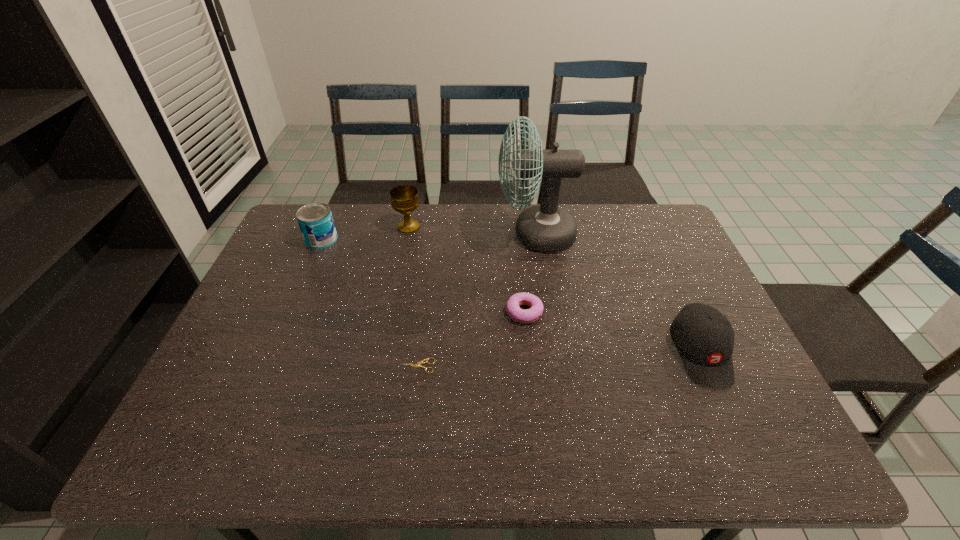
This screenshot has width=960, height=540. In the image, there is a desktop. Identify the location of blank space at the far edge. (423, 206).

I want to click on free space at the near edge, so click(x=649, y=455).

Image resolution: width=960 pixels, height=540 pixels. In order to click on vacant space at the right edge of the desktop in this screenshot , I will do `click(667, 296)`.

Find the location of a particular element. The width and height of the screenshot is (960, 540). blank space at the far left corner of the desktop is located at coordinates (335, 211).

This screenshot has width=960, height=540. I want to click on free location at the near left corner, so click(x=177, y=433).

Locate an element on the screen. The width and height of the screenshot is (960, 540). vacant region at the far right corner is located at coordinates (659, 224).

In order to click on vacant region between the shortest object and the baseball cap in this screenshot , I will do `click(559, 360)`.

Image resolution: width=960 pixels, height=540 pixels. I want to click on vacant area that lies between the leftmost object and the second tallest object, so click(365, 233).

Find the location of `free space between the second shortest object and the fan`. free space between the second shortest object and the fan is located at coordinates (530, 274).

This screenshot has width=960, height=540. Find the location of `blank region between the second shortest object and the fan`. blank region between the second shortest object and the fan is located at coordinates (530, 274).